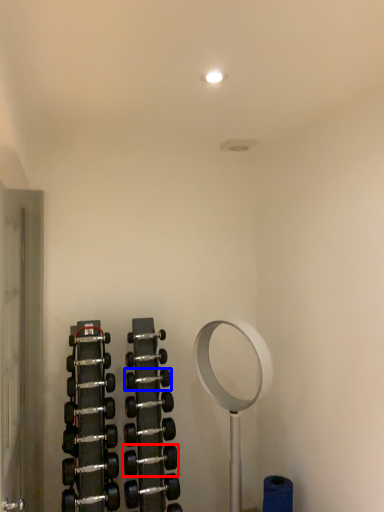
Question: Which object appears farthest to the camera in this image, dumbbell (highlighted by a red box) or dumbbell (highlighted by a blue box)?

Choices:
 (A) dumbbell
 (B) dumbbell

Answer: (B)